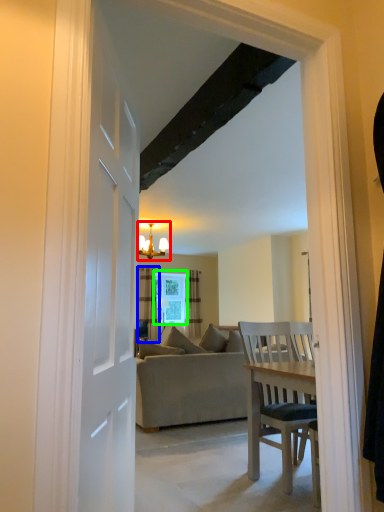
Question: Based on their relative distances, which object is nearer to light fixture (highlighted by a red box)? Choose from curtain (highlighted by a blue box) and window (highlighted by a green box).

Choices:
 (A) curtain
 (B) window

Answer: (A)